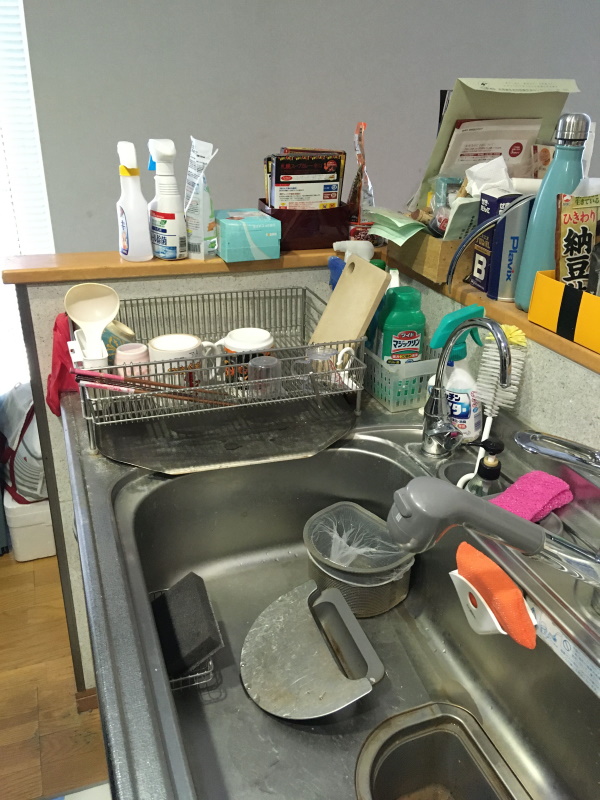
Where is `floor`? floor is located at coordinates (13, 710).